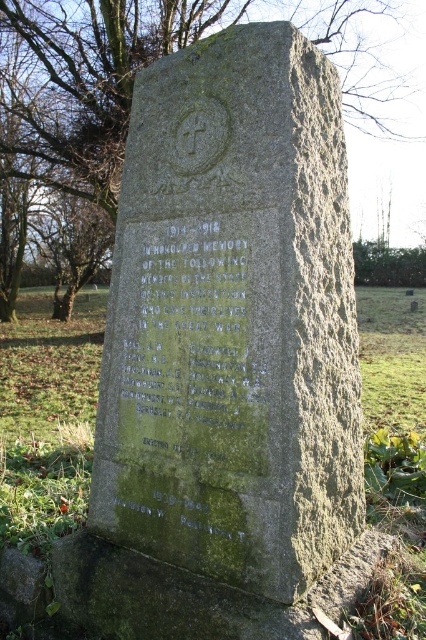
In the scene shown: You are a maintenance worker assigned to clean the area around the green stone gravestone at center and the green mossy stone at upper left. You have a 10 meter long hose. Can you reach both stones with the hose without moving it?

The green stone gravestone at center is 11.70 meters away from the green mossy stone at upper left, so the 10 meter hose is too short to reach both stones without moving it.

You are standing in front of the weathered stone memorial monument. There are two points marked on the monument. One is at coordinate point [244,189] and the other is at point [362,65]. Which point is closer to you?

Point [244,189] is closer to the camera than point [362,65].